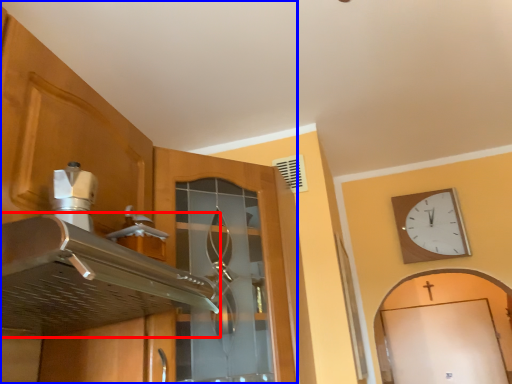
Question: Which object is further to the camera taking this photo, exhaust hood (highlighted by a red box) or cabinetry (highlighted by a blue box)?

Choices:
 (A) exhaust hood
 (B) cabinetry

Answer: (B)